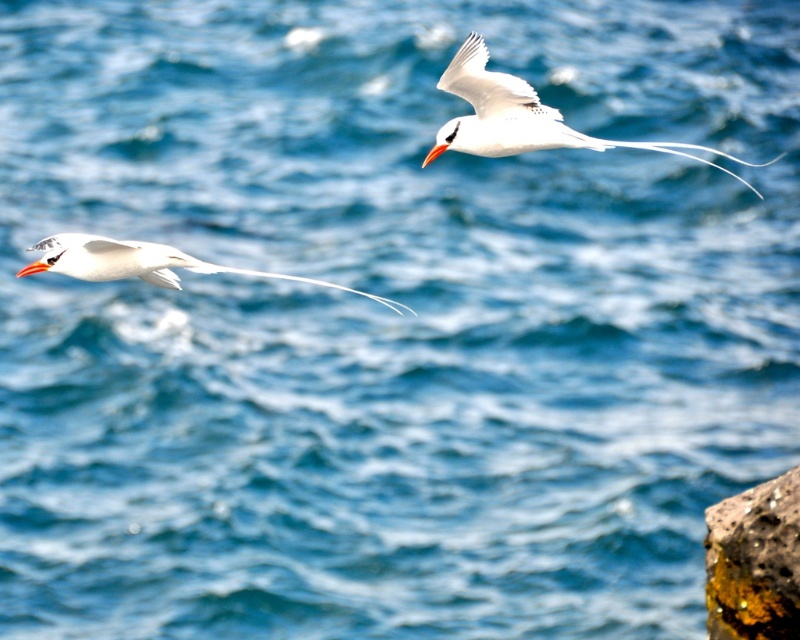
You are a photographer trying to capture the white glossy bird at left and the orange glossy beak at upper left in a single shot. Based on their positions, which object is positioned more to the right side of the image?

The white glossy bird at left is positioned more to the right side of the image compared to the orange glossy beak at upper left.

Based on the photo, you are a photographer trying to capture the seabirds in the image. You notice two points marked in the scene. Which point is closer to your camera lens? Please choose between point A and point B, where point A is point (722, 611) and point B is point (68, 260).

Point A is closer to the camera lens because it is further to the viewer than point B.

You are a photographer trying to capture the white glossy bird at upper right in your shot. You notice the rusty stone at lower right might block the view. Based on their sizes in the image, which object is larger and could potentially obstruct the bird?

The rusty stone at lower right is taller than the white glossy bird at upper right, so it could potentially obstruct the view of the bird.